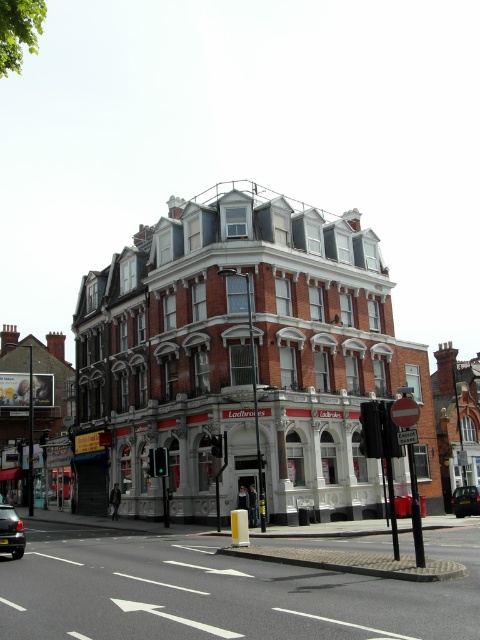
Between point (188, 572) and point (1, 547), which one is positioned in front?

Positioned in front is point (188, 572).

Image resolution: width=480 pixels, height=640 pixels. What do you see at coordinates (220, 593) in the screenshot?
I see `black asphalt road at center` at bounding box center [220, 593].

Identify the location of black asphalt road at center. The height and width of the screenshot is (640, 480). (220, 593).

Can you confirm if black asphalt road at center is bigger than black metallic car at center?

Correct, black asphalt road at center is larger in size than black metallic car at center.

Between black asphalt road at center and black metallic car at center, which one has less height?

black metallic car at center

Between point (235, 611) and point (477, 493), which one is positioned behind?

The point (477, 493) is behind.

At what (x,y) coordinates should I click in order to perform the action: click on black asphalt road at center. Please return your answer as a coordinate pair (x, y). Looking at the image, I should click on (220, 593).

Which is above, black glossy car at center or black metallic car at center?

black glossy car at center is higher up.

Is point (14, 528) farther from camera compared to point (472, 492)?

That is False.

Who is more distant from viewer, (21, 540) or (478, 496)?

The point (478, 496) is behind.

Where is `black glossy car at center`? This screenshot has height=640, width=480. black glossy car at center is located at coordinates [11, 531].